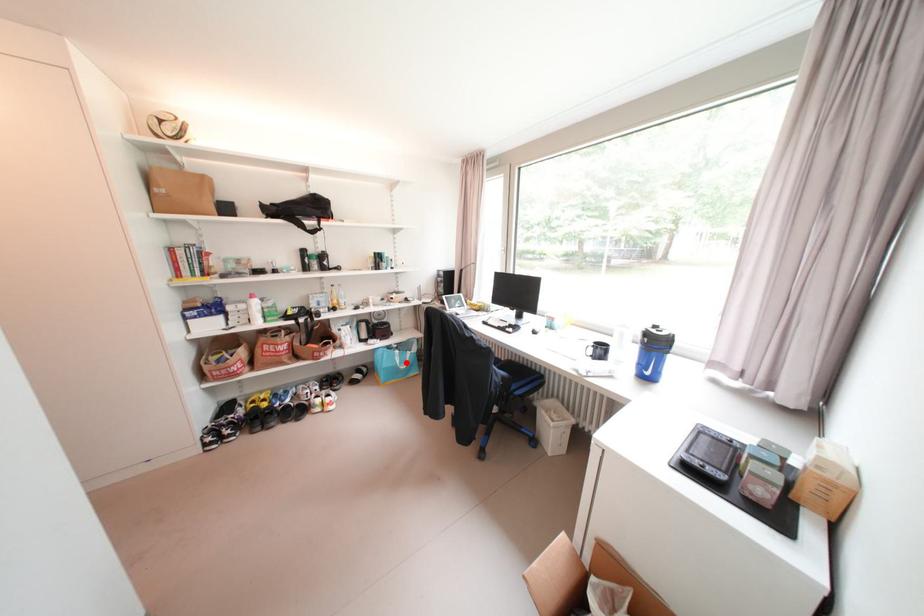
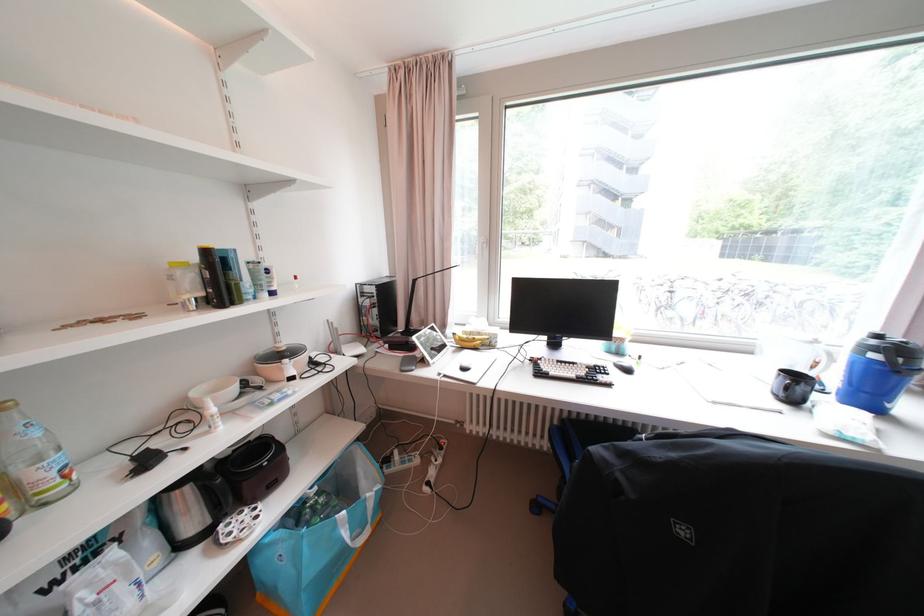
Question: I am providing you with two images of the same scene from different viewpoints. A red point is marked on the first image. Can you still see the location of the red point in image 2?

Choices:
 (A) Yes
 (B) No

Answer: (A)